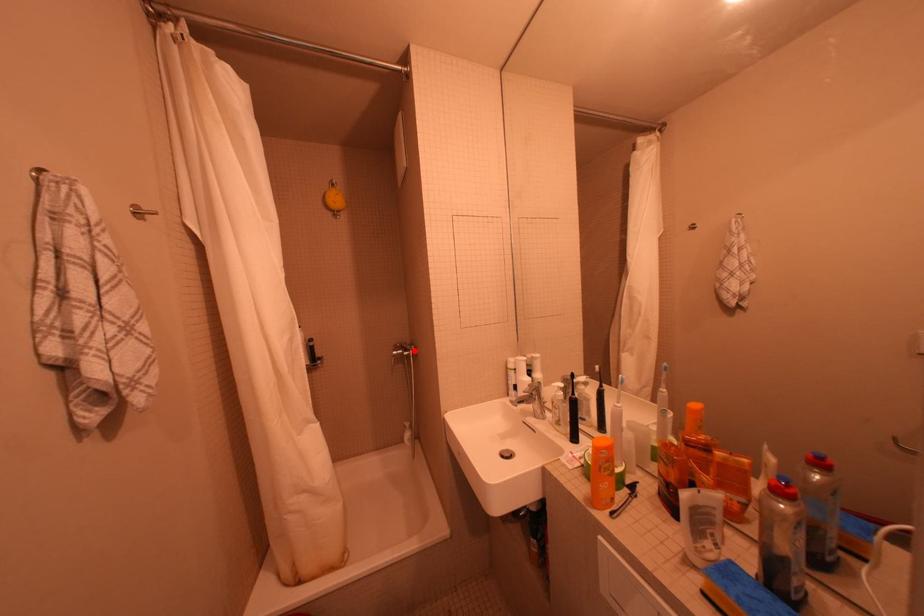
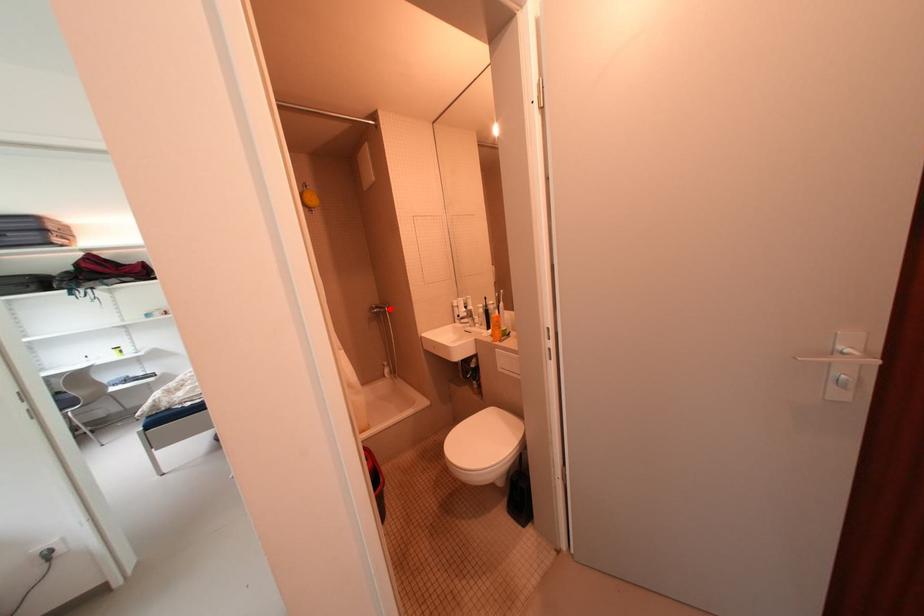
I am providing you with two images of the same scene from different viewpoints. A red point is marked on the first image and another point is marked on the second image. Do the highlighted points in image1 and image2 indicate the same real-world spot?

Yes